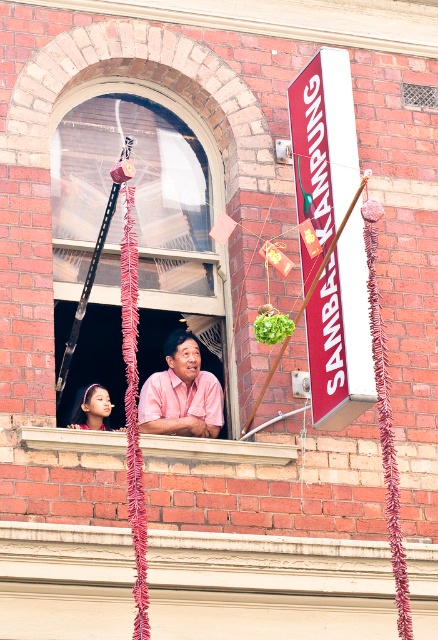
What is the spatial relationship between the clear glass window at center and the pink matte shirt at window? Is the window to the left or right of the shirt?

The clear glass window at center is to the left of the pink matte shirt at window.

You are a photographer taking a picture of the festive scene. You notice the pink matte shirt at window and the smooth skin face at window left. Which object occupies more horizontal space in the image?

The pink matte shirt at window occupies more horizontal space than the smooth skin face at window left because its width is larger.